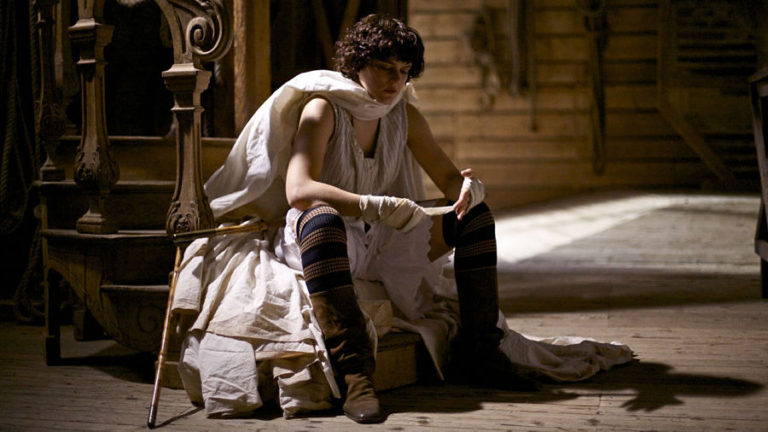
You are a GUI agent. You are given a task and a screenshot of the screen. Output one action in this format:
    pyautogui.click(x=<x>, y=<y>)
    Task: Click on the bannister
    The image size is (768, 432).
    Given the screenshot: What is the action you would take?
    pyautogui.click(x=180, y=160), pyautogui.click(x=91, y=126)